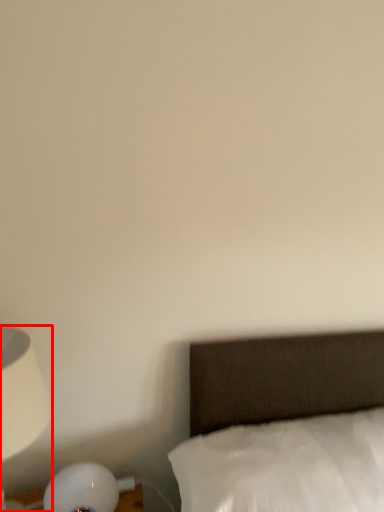
Question: From the image's perspective, considering the relative positions of lamp (annotated by the red box) and bed in the image provided, where is lamp (annotated by the red box) located with respect to the staircase?

Choices:
 (A) above
 (B) below

Answer: (A)